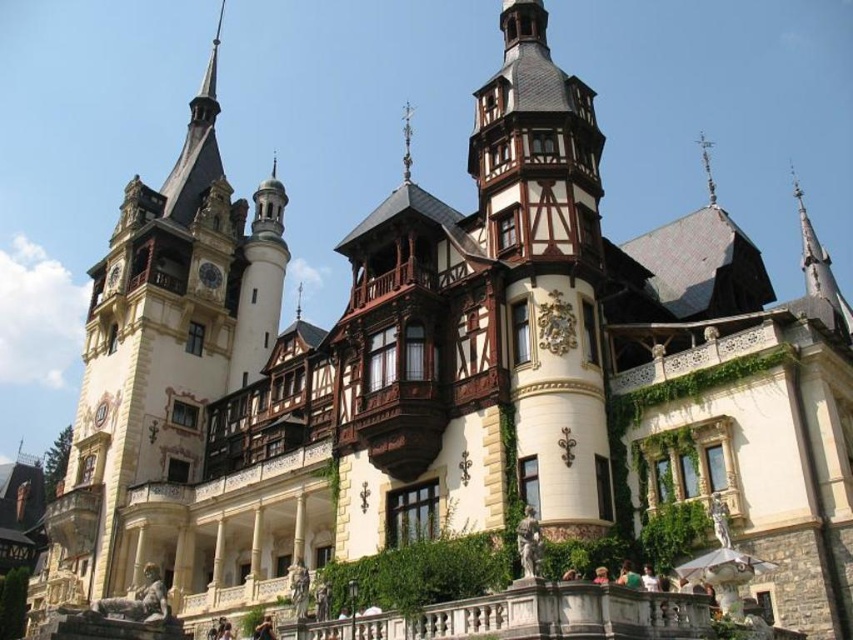
You are an architect inspecting the castle. You notice the wooden clock tower at left and the matte black clock at upper center. Which clock is larger in size?

The wooden clock tower at left is bigger than the matte black clock at upper center.

Consider the image. You are an architect examining the castle facade. You notice the wooden clock tower at left and the matte black clock at upper center. Which clock is located more to the left side of the facade?

The wooden clock tower at left is positioned on the left side of matte black clock at upper center, so it is more to the left.

You are standing at a point where you can see the grand castle. If you want to move closer to the castle, which direction should you move relative to the point marked as point [100,356]?

The point [100,356] is 92.26 meters away from the viewer. To move closer to the castle, you should move towards the point [100,356] since it is the direction of the castle.